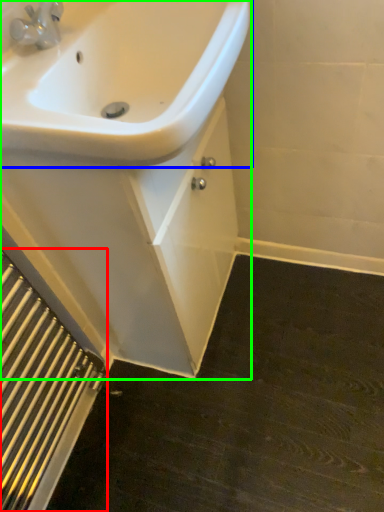
Question: Considering the real-world distances, which object is closest to radiator (highlighted by a red box)? sink (highlighted by a blue box) or porcelain (highlighted by a green box).

Choices:
 (A) sink
 (B) porcelain

Answer: (B)